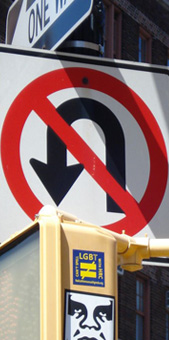
Where is `window shutters`? window shutters is located at coordinates (160, 309), (127, 313).